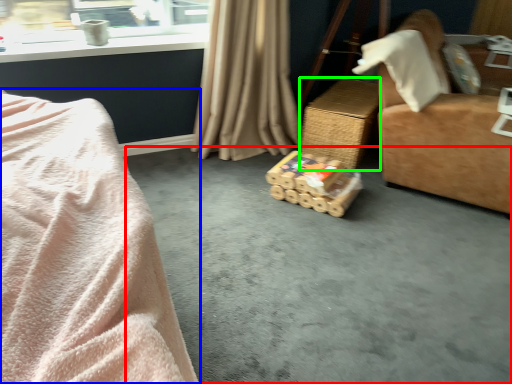
Question: Which is farther away from concrete (highlighted by a red box)? bed (highlighted by a blue box) or table (highlighted by a green box)?

Choices:
 (A) bed
 (B) table

Answer: (A)